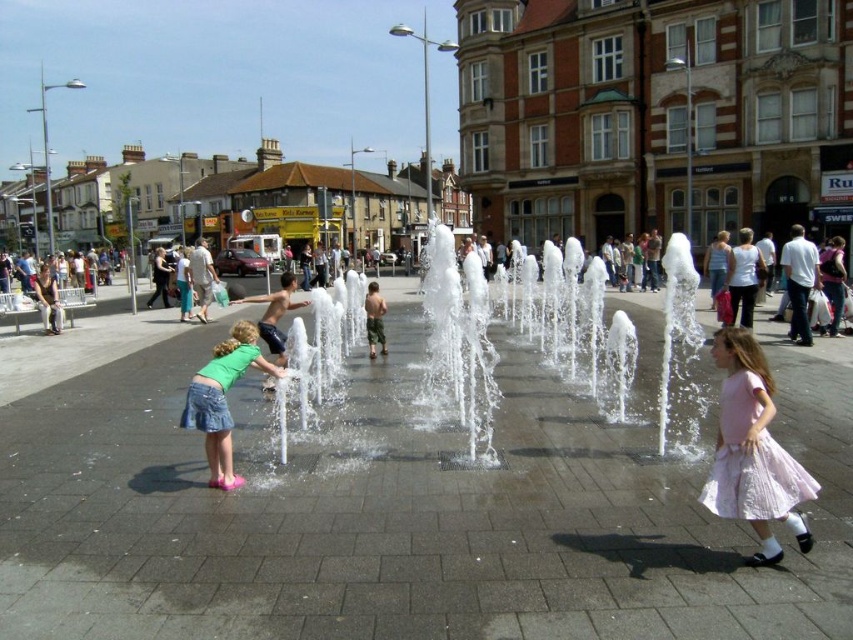
What is the significance of the point marked at coordinates (x=519, y=333) in the image?

The point marked at coordinates (x=519, y=333) indicates the location of clear water jets at the center of the fountain.

You are a fashion designer observing the crowd at the fountain. You notice a person wearing a pink pleated skirt at lower right and a white cotton tank top at center. Which clothing item is shorter in height?

The pink pleated skirt at lower right is not as tall as the white cotton tank top at center, so the pink pleated skirt at lower right is shorter in height.

You are a fashion designer observing a model wearing the white cotton tank top at center and the light blue denim skirt at center. Which clothing item is positioned higher on the model?

The white cotton tank top at center is positioned higher than the light blue denim skirt at center, so it is above the skirt.